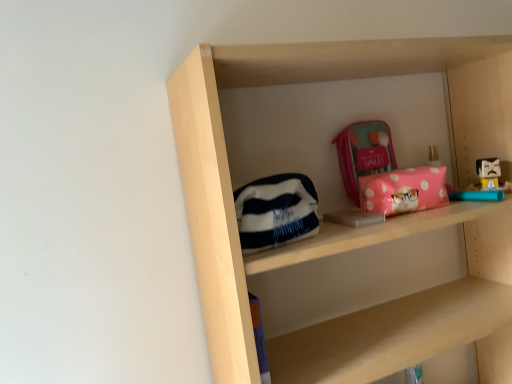
Question: Can you confirm if pink polka dot pouch at center is wider than matte pink pouch at upper center, placed as the 2th pouch when sorted from front to back?

Choices:
 (A) no
 (B) yes

Answer: (B)

Question: Is pink polka dot pouch at center positioned with its back to matte pink pouch at upper center, the 2th pouch positioned from the bottom?

Choices:
 (A) no
 (B) yes

Answer: (A)

Question: Is pink polka dot pouch at center at the left side of matte pink pouch at upper center, marked as the 2th pouch in a left-to-right arrangement?

Choices:
 (A) no
 (B) yes

Answer: (A)

Question: Is the position of pink polka dot pouch at center more distant than that of matte pink pouch at upper center, placed as the 2th pouch when sorted from front to back?

Choices:
 (A) no
 (B) yes

Answer: (A)

Question: From the image's perspective, is pink polka dot pouch at center above matte pink pouch at upper center, the 1th pouch positioned from the back?

Choices:
 (A) no
 (B) yes

Answer: (A)

Question: Is the depth of pink polka dot pouch at center less than that of matte pink pouch at upper center, arranged as the first pouch when viewed from the right?

Choices:
 (A) yes
 (B) no

Answer: (A)

Question: From the image's perspective, does matte pink pouch at upper center, placed as the 2th pouch when sorted from front to back, appear lower than pink polka dot pouch at center?

Choices:
 (A) no
 (B) yes

Answer: (A)

Question: Considering the relative sizes of matte pink pouch at upper center, placed as the 2th pouch when sorted from front to back, and pink polka dot pouch at center in the image provided, is matte pink pouch at upper center, placed as the 2th pouch when sorted from front to back, taller than pink polka dot pouch at center?

Choices:
 (A) no
 (B) yes

Answer: (B)

Question: Does matte pink pouch at upper center, which is the first pouch from top to bottom, have a greater width compared to pink polka dot pouch at center?

Choices:
 (A) yes
 (B) no

Answer: (B)

Question: From a real-world perspective, is matte pink pouch at upper center, placed as the 2th pouch when sorted from front to back, on top of pink polka dot pouch at center?

Choices:
 (A) yes
 (B) no

Answer: (A)

Question: Does matte pink pouch at upper center, which is the first pouch from top to bottom, turn towards pink polka dot pouch at center?

Choices:
 (A) yes
 (B) no

Answer: (B)

Question: Considering the relative sizes of matte pink pouch at upper center, which is the first pouch from top to bottom, and pink polka dot pouch at center in the image provided, is matte pink pouch at upper center, which is the first pouch from top to bottom, thinner than pink polka dot pouch at center?

Choices:
 (A) no
 (B) yes

Answer: (B)

Question: Considering the relative positions of white fleece pouch at center, which ranks as the 2th pouch in top-to-bottom order, and pink polka dot pouch at center in the image provided, is white fleece pouch at center, which ranks as the 2th pouch in top-to-bottom order, to the right of pink polka dot pouch at center from the viewer's perspective?

Choices:
 (A) yes
 (B) no

Answer: (B)